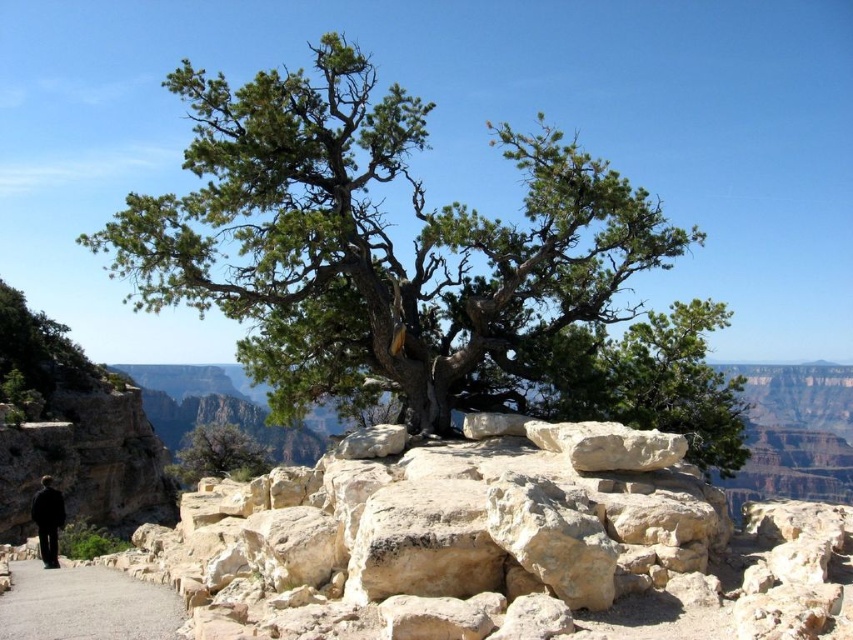
Describe the element at coordinates (418, 268) in the screenshot. The width and height of the screenshot is (853, 640). I see `green textured rock at center` at that location.

Does green textured rock at center have a larger size compared to beige rock at center?

Correct, green textured rock at center is larger in size than beige rock at center.

Between point (653, 336) and point (538, 545), which one is positioned in front?

Point (538, 545)

In order to click on green textured rock at center in this screenshot , I will do `click(418, 268)`.

Does beige rock at center come in front of black fabric man at lower left?

Yes, it is.

The image size is (853, 640). What do you see at coordinates (495, 552) in the screenshot?
I see `beige rock at center` at bounding box center [495, 552].

This screenshot has height=640, width=853. I want to click on beige rock at center, so click(x=495, y=552).

Between point (624, 573) and point (57, 624), which one is positioned behind?

Point (57, 624)

Is point (822, 512) farther from camera compared to point (73, 611)?

Yes, it is.

Which is behind, point (317, 497) or point (102, 566)?

The point (102, 566) is behind.

At what (x,y) coordinates should I click in order to perform the action: click on beige rock at center. Please return your answer as a coordinate pair (x, y). This screenshot has height=640, width=853. Looking at the image, I should click on (495, 552).